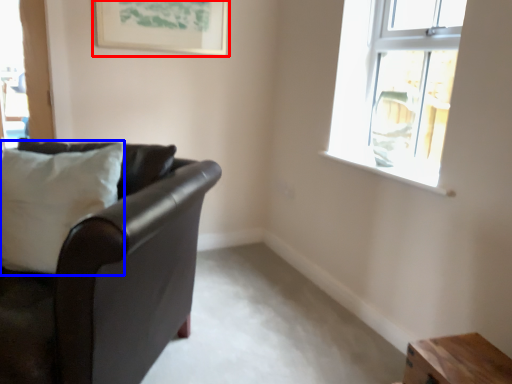
Question: Which object appears farthest to the camera in this image, picture frame (highlighted by a red box) or pillow (highlighted by a blue box)?

Choices:
 (A) picture frame
 (B) pillow

Answer: (A)